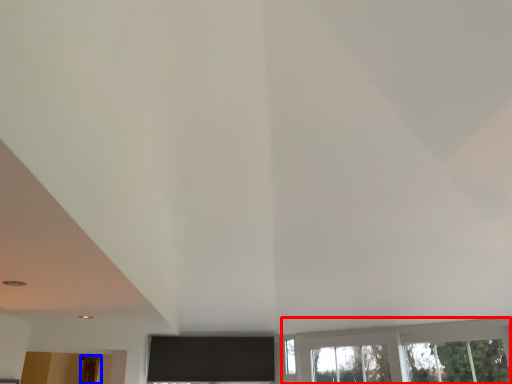
Question: Which point is further to the camera, window (highlighted by a red box) or curtain (highlighted by a blue box)?

Choices:
 (A) window
 (B) curtain

Answer: (B)